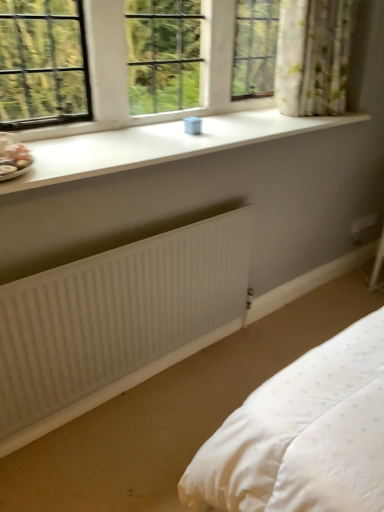
The width and height of the screenshot is (384, 512). Identify the location of white ribbed radiator at lower center. (116, 321).

From the image's perspective, between floral fabric curtain at upper right and matte pink porcelain at left, which one is located above?

floral fabric curtain at upper right is shown above in the image.

Is floral fabric curtain at upper right bigger or smaller than matte pink porcelain at left?

floral fabric curtain at upper right is bigger than matte pink porcelain at left.

From a real-world perspective, is floral fabric curtain at upper right physically located above or below matte pink porcelain at left?

From a real-world perspective, floral fabric curtain at upper right is physically above matte pink porcelain at left.

Could you tell me if white ribbed radiator at lower center is turned towards matte pink porcelain at left?

No, white ribbed radiator at lower center is not aimed at matte pink porcelain at left.

Which is closer, (196, 229) or (26, 148)?

Point (196, 229) is positioned farther from the camera compared to point (26, 148).

Which object is closer to the camera, white ribbed radiator at lower center or matte pink porcelain at left?

Positioned in front is white ribbed radiator at lower center.

From a real-world perspective, is white ribbed radiator at lower center positioned over matte pink porcelain at left based on gravity?

No, from a real-world perspective, white ribbed radiator at lower center is not over matte pink porcelain at left

Does white smooth window sill at upper center have a greater width compared to white plastic container at upper center?

Yes.

How far apart are white smooth window sill at upper center and white plastic container at upper center?

white smooth window sill at upper center is 11.88 inches from white plastic container at upper center.

From a real-world perspective, which is physically above, white smooth window sill at upper center or white plastic container at upper center?

Result: In real-world perspective, white plastic container at upper center is above.

Does matte pink porcelain at left lie behind white ribbed radiator at lower center?

Yes.

Are matte pink porcelain at left and white ribbed radiator at lower center far apart?

Actually, matte pink porcelain at left and white ribbed radiator at lower center are a little close together.

Is white ribbed radiator at lower center at the back of matte pink porcelain at left?

matte pink porcelain at left does not have its back to white ribbed radiator at lower center.

Considering the relative sizes of matte pink porcelain at left and white ribbed radiator at lower center in the image provided, is matte pink porcelain at left thinner than white ribbed radiator at lower center?

Incorrect, the width of matte pink porcelain at left is not less than that of white ribbed radiator at lower center.

Does floral fabric curtain at upper right appear on the left side of white plastic container at upper center?

In fact, floral fabric curtain at upper right is to the right of white plastic container at upper center.

Considering the sizes of floral fabric curtain at upper right and white plastic container at upper center in the image, is floral fabric curtain at upper right taller or shorter than white plastic container at upper center?

In the image, floral fabric curtain at upper right appears to be taller than white plastic container at upper center.

Is white plastic container at upper center at the back of floral fabric curtain at upper right?

Yes, floral fabric curtain at upper right is facing away from white plastic container at upper center.

What are the coordinates of `curtain on the right of white plastic container at upper center` in the screenshot? It's located at (313, 56).

From the image's perspective, who appears lower, white smooth window sill at upper center or white ribbed radiator at lower center?

white ribbed radiator at lower center is shown below in the image.

In the scene shown: Is white smooth window sill at upper center positioned before white ribbed radiator at lower center?

Yes, white smooth window sill at upper center is closer to the viewer.

Considering the relative sizes of white smooth window sill at upper center and white ribbed radiator at lower center in the image provided, is white smooth window sill at upper center thinner than white ribbed radiator at lower center?

In fact, white smooth window sill at upper center might be wider than white ribbed radiator at lower center.

Considering the sizes of white ribbed radiator at lower center and white smooth window sill at upper center in the image, is white ribbed radiator at lower center wider or thinner than white smooth window sill at upper center?

Considering their sizes, white ribbed radiator at lower center looks slimmer than white smooth window sill at upper center.

Is white ribbed radiator at lower center bigger or smaller than white smooth window sill at upper center?

Considering their sizes, white ribbed radiator at lower center takes up less space than white smooth window sill at upper center.

Can you confirm if white ribbed radiator at lower center is taller than white smooth window sill at upper center?

Correct, white ribbed radiator at lower center is much taller as white smooth window sill at upper center.

The image size is (384, 512). In order to click on food that appears on the left of floral fabric curtain at upper right in this screenshot , I will do `click(13, 158)`.

Locate an element on the screen. This screenshot has height=512, width=384. food that is behind the white ribbed radiator at lower center is located at coordinates tap(13, 158).

From the image, which object appears to be farther from matte pink porcelain at left, white plastic container at upper center or white smooth window sill at upper center?

white smooth window sill at upper center.

Estimate the real-world distances between objects in this image. Which object is closer to white smooth window sill at upper center, white ribbed radiator at lower center or white plastic container at upper center?

The object closer to white smooth window sill at upper center is white plastic container at upper center.

Based on their spatial positions, is white plastic container at upper center or white smooth window sill at upper center further from white ribbed radiator at lower center?

Among the two, white plastic container at upper center is located further to white ribbed radiator at lower center.

From the image, which object appears to be farther from matte pink porcelain at left, white smooth window sill at upper center or floral fabric curtain at upper right?

floral fabric curtain at upper right lies further to matte pink porcelain at left than the other object.

Based on their spatial positions, is floral fabric curtain at upper right or matte pink porcelain at left closer to white smooth window sill at upper center?

floral fabric curtain at upper right lies closer to white smooth window sill at upper center than the other object.

Estimate the real-world distances between objects in this image. Which object is further from floral fabric curtain at upper right, white plastic container at upper center or matte pink porcelain at left?

The object further to floral fabric curtain at upper right is matte pink porcelain at left.

When comparing their distances from white ribbed radiator at lower center, does matte pink porcelain at left or white smooth window sill at upper center seem further?

The object further to white ribbed radiator at lower center is matte pink porcelain at left.

Which object lies nearer to the anchor point white plastic container at upper center, white smooth window sill at upper center or matte pink porcelain at left?

white smooth window sill at upper center.

This screenshot has height=512, width=384. Identify the location of food that lies between white plastic container at upper center and white ribbed radiator at lower center from top to bottom. (13, 158).

Where is `food that lies between floral fabric curtain at upper right and white ribbed radiator at lower center from top to bottom`? The image size is (384, 512). food that lies between floral fabric curtain at upper right and white ribbed radiator at lower center from top to bottom is located at coordinates (13, 158).

Where is `window between matte pink porcelain at left and floral fabric curtain at upper right from left to right`? The width and height of the screenshot is (384, 512). window between matte pink porcelain at left and floral fabric curtain at upper right from left to right is located at coordinates pyautogui.click(x=126, y=73).

Find the location of `window between matte pink porcelain at left and white smooth window sill at upper center from left to right`. window between matte pink porcelain at left and white smooth window sill at upper center from left to right is located at coordinates (126, 73).